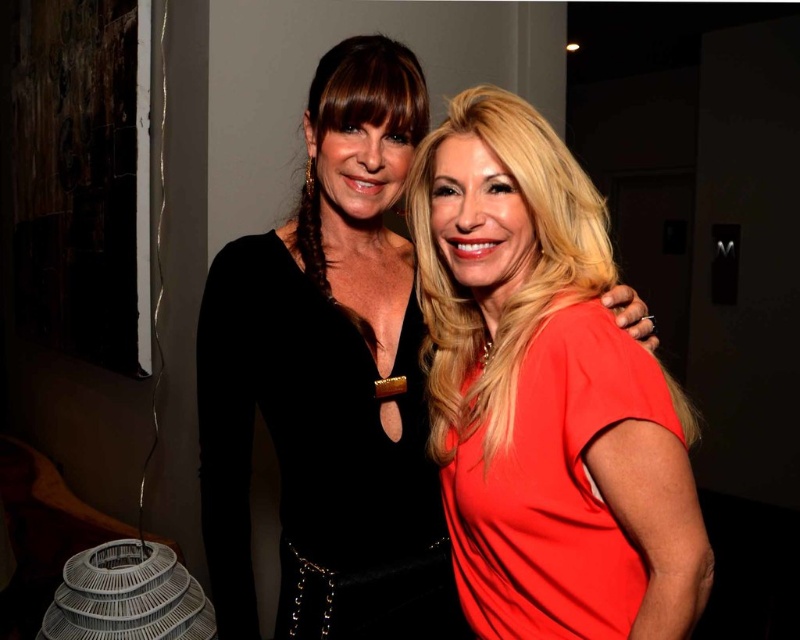
You are attending a formal event and need to choose between the velvet black dress at center and the matte red dress at right. Based on their appearance in the image, which dress would be more appropriate for a formal event?

The velvet black dress at center is more appropriate for a formal event as it has a greater height compared to the matte red dress at right, suggesting a more elegant and sophisticated design.

You are at a party and want to take a photo of both the matte black dress at center and the matte red dress at right. Since you want to capture them side by side, which dress should be on your left to match their actual positions?

The matte black dress at center should be on your left because it is positioned on the left side of the matte red dress at right in the image.